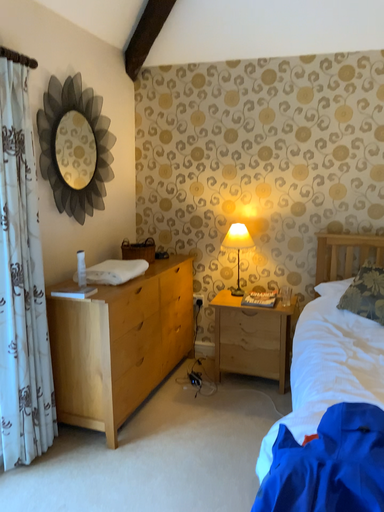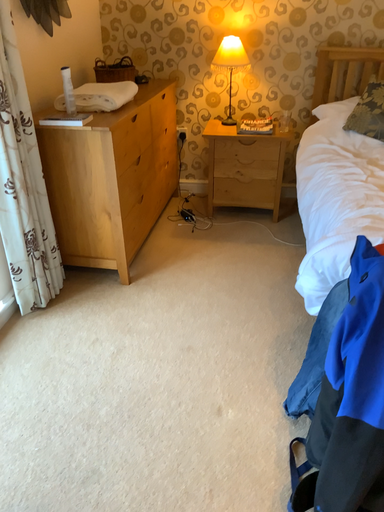
Question: How did the camera likely rotate when shooting the video?

Choices:
 (A) rotated upward
 (B) rotated downward

Answer: (B)